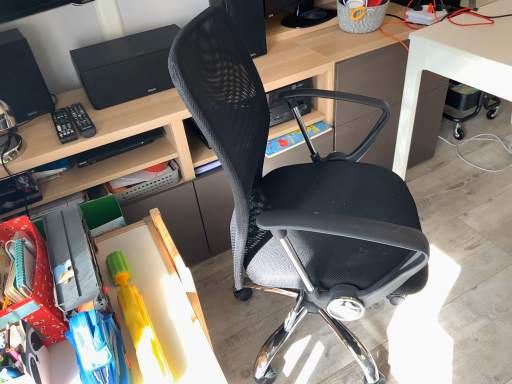
The height and width of the screenshot is (384, 512). What are the coordinates of `free spot behind rubber yellow toy at lower left` in the screenshot? It's located at (146, 251).